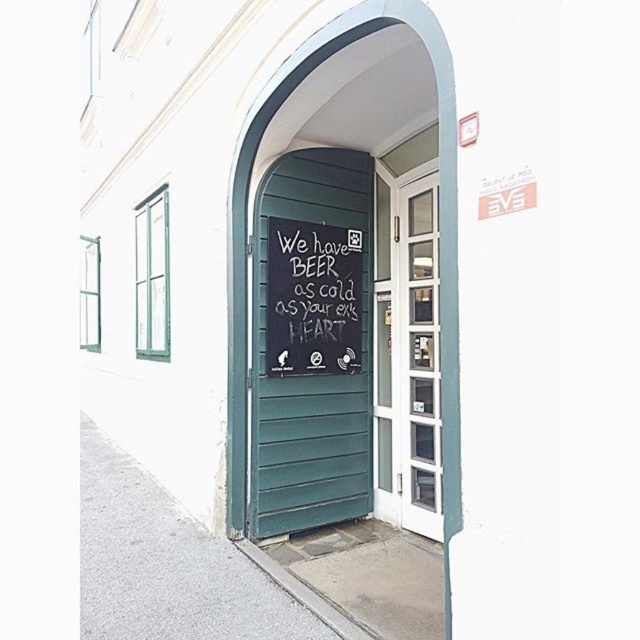
Looking at this image, you are a delivery person trying to enter the establishment. You have a large package that requires a door at least 1 meter wide. The green wooden door at center is 1.2 meters wide, and the white glass door at center is 0.8 meters wide. Which door should you use?

The green wooden door at center is larger and 1.2 meters wide, so you should use the green wooden door at center to carry your large package through.

You are a delivery person trying to deliver a package to the establishment. The package is too large to fit through any door smaller than 5 inches. Can you deliver the package through the green wooden door at center or the chalkboard at center?

The green wooden door at center is 4.87 inches from chalkboard at center, so the distance between them is less than 5 inches. However, the question is about the size of the doors, not the distance between the door and chalkboard. The provided information does not specify the dimensions of the green wooden door at center or the chalkboard at center, so it is impossible to determine if the package can fit through either. Please check the actual size of the doors.

You are a delivery person trying to deliver a package to the establishment. The package is too large to fit through the door on the right. Which door should you use, the green wooden door at center or the chalkboard at center?

The green wooden door at center is taller than the chalkboard at center, so you should use the green wooden door at center to deliver the package since it is taller and likely provides sufficient clearance.